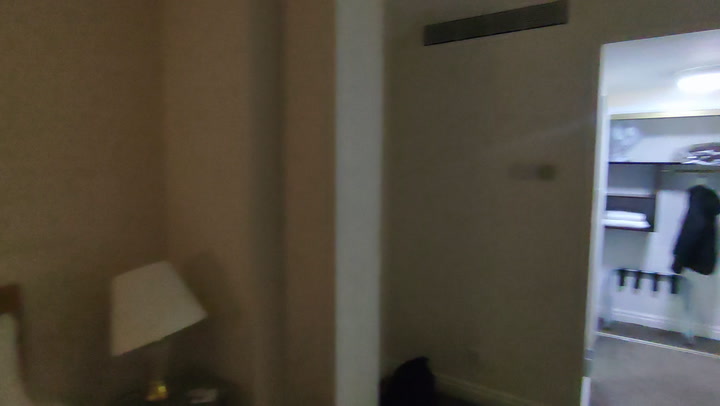
Locate an element on the screen. This screenshot has width=720, height=406. white painted walls is located at coordinates (21, 114), (238, 104), (522, 121).